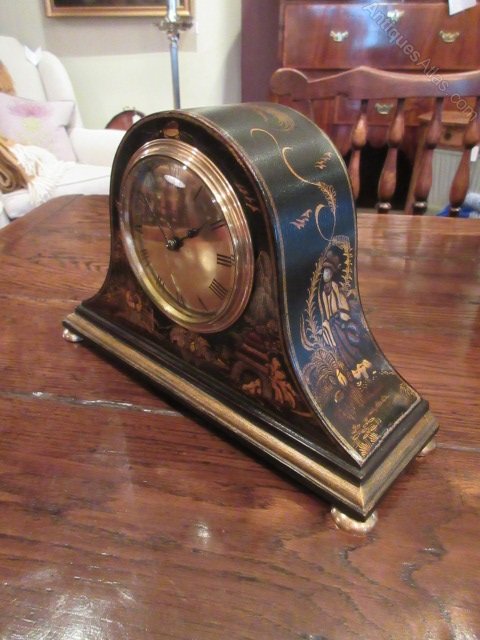
Identify the location of empty space on table. The height and width of the screenshot is (640, 480). (170, 520).